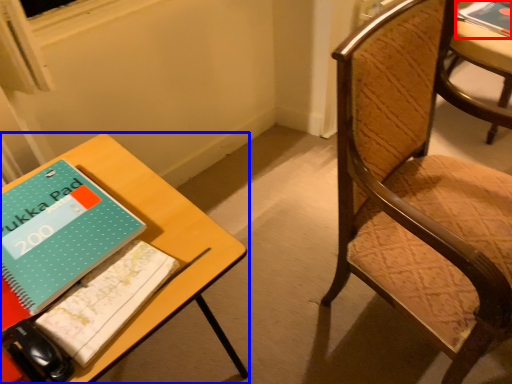
Question: Which point is further to the camera, book (highlighted by a red box) or table (highlighted by a blue box)?

Choices:
 (A) book
 (B) table

Answer: (A)